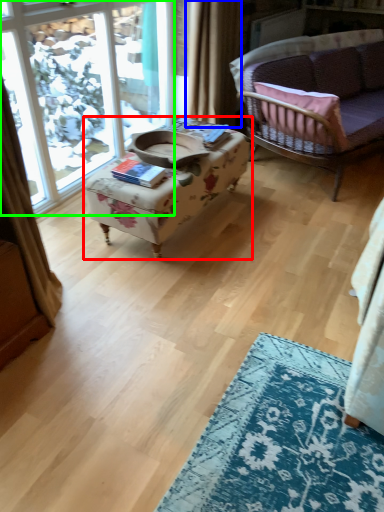
Question: Which is farther away from table (highlighted by a red box)? curtain (highlighted by a blue box) or window (highlighted by a green box)?

Choices:
 (A) curtain
 (B) window

Answer: (B)